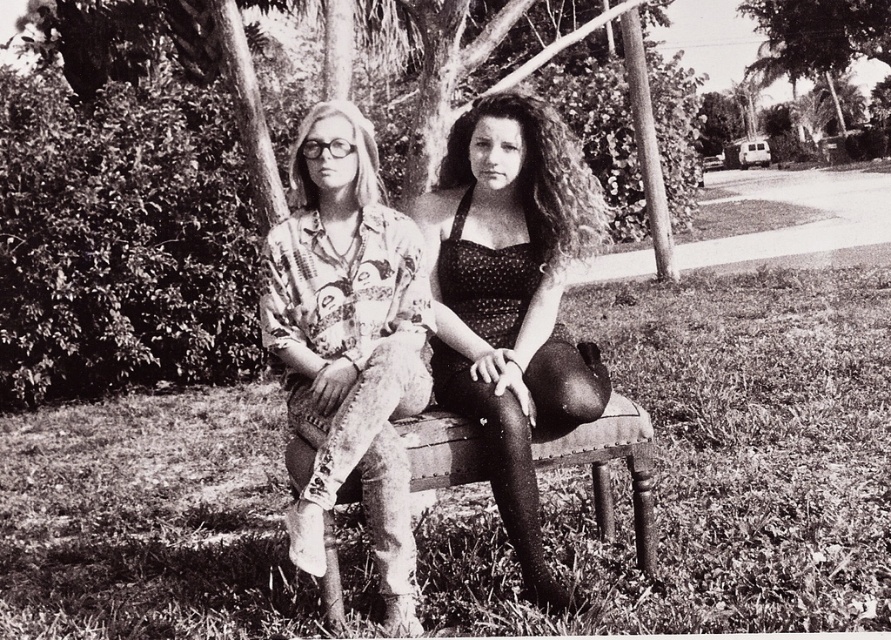
Which is in front, point (515, 481) or point (304, 525)?

Point (304, 525) is in front.

Describe the element at coordinates (512, 300) in the screenshot. I see `polka dot fabric dress at center` at that location.

Measure the distance between point (475, 240) and camera.

The distance of point (475, 240) from camera is 9.82 feet.

The height and width of the screenshot is (640, 891). I want to click on polka dot fabric dress at center, so coord(512,300).

Which is above, printed fabric shirt at center or faux leather bench at center?

printed fabric shirt at center is higher up.

Is point (379, 445) in front of point (300, 483)?

Yes, it is in front of point (300, 483).

Where is `printed fabric shirt at center`? The width and height of the screenshot is (891, 640). printed fabric shirt at center is located at coordinates (349, 342).

Can you confirm if smooth bark tree trunk at center is bigger than polka dot fabric dress at center?

Yes.

Does smooth bark tree trunk at center appear under polka dot fabric dress at center?

Incorrect, smooth bark tree trunk at center is not positioned below polka dot fabric dress at center.

You are a GUI agent. You are given a task and a screenshot of the screen. Output one action in this format:
    pyautogui.click(x=<x>, y=<y>)
    Task: Click on the smooth bark tree trunk at center
    Image resolution: width=891 pixels, height=640 pixels.
    Given the screenshot: What is the action you would take?
    pyautogui.click(x=121, y=205)